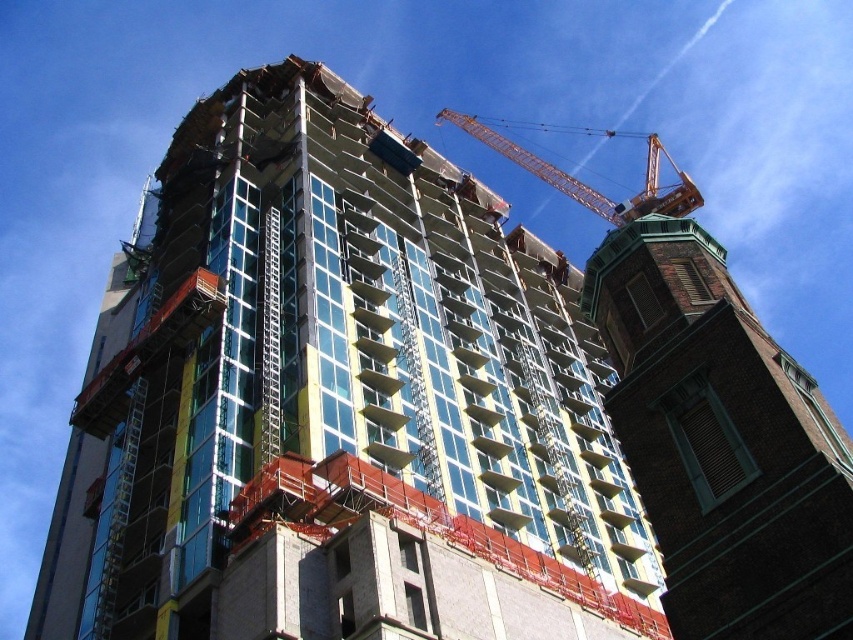
You are a construction worker standing on the ground floor of the glassy concrete building at center. You need to check the height difference between your current position and the brown brick tower at right. Based on the scene, can you determine which structure is taller?

The glassy concrete building at center is above the brown brick tower at right, meaning it is taller. Therefore, the glassy concrete building at center is taller than the brown brick tower at right.

You are an architect evaluating the construction site. You notice the glassy concrete building at center and the orange metallic crane at upper center. Which of these two objects has a smaller width when viewed from above?

The glassy concrete building at center is thinner than the orange metallic crane at upper center, so the glassy concrete building at center has a smaller width when viewed from above.